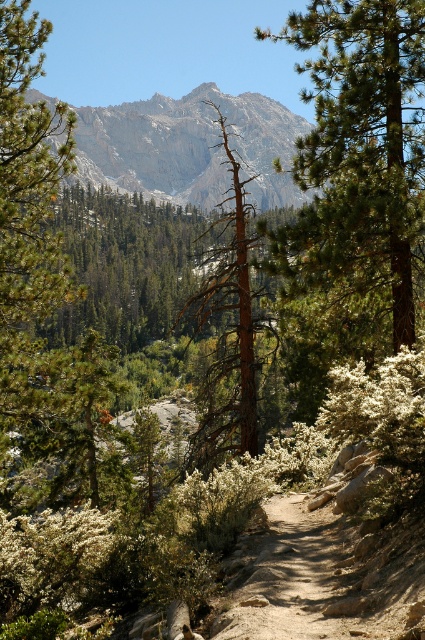
Question: Can you confirm if rugged granite mountain at center is positioned to the right of brown rough bark tree at center?

Choices:
 (A) no
 (B) yes

Answer: (A)

Question: Which object appears closest to the camera in this image?

Choices:
 (A) rugged granite mountain at center
 (B) brown rough bark tree at center

Answer: (B)

Question: Does rugged granite mountain at center have a greater width compared to brown rough bark tree at center?

Choices:
 (A) no
 (B) yes

Answer: (B)

Question: Which is nearer to the brown rough bark tree at center?

Choices:
 (A) rugged granite mountain at center
 (B) green needle-like at center

Answer: (B)

Question: Which point appears closest to the camera in this image?

Choices:
 (A) (235, 180)
 (B) (192, 163)
 (C) (388, 268)

Answer: (C)

Question: Is green needle-like at center bigger than rugged granite mountain at center?

Choices:
 (A) yes
 (B) no

Answer: (B)